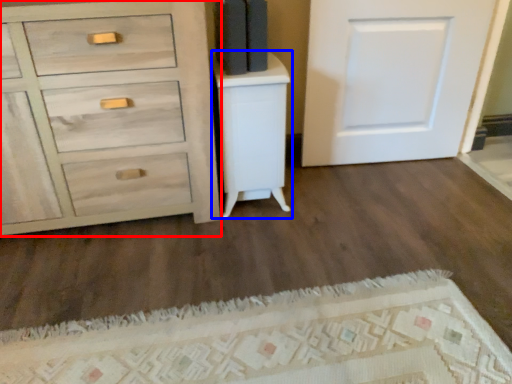
Question: Which point is further to the camera, chest of drawers (highlighted by a red box) or vanity (highlighted by a blue box)?

Choices:
 (A) chest of drawers
 (B) vanity

Answer: (B)